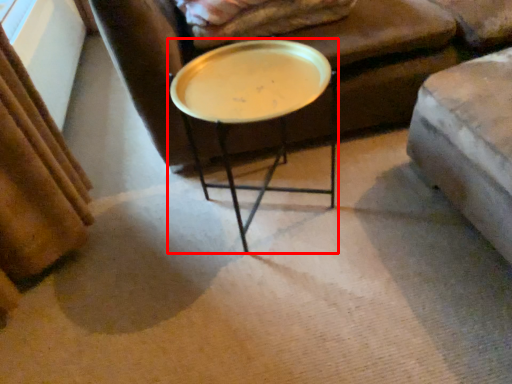
Question: Where is coffee table (annotated by the red box) located in relation to blanket in the image?

Choices:
 (A) left
 (B) right

Answer: (A)